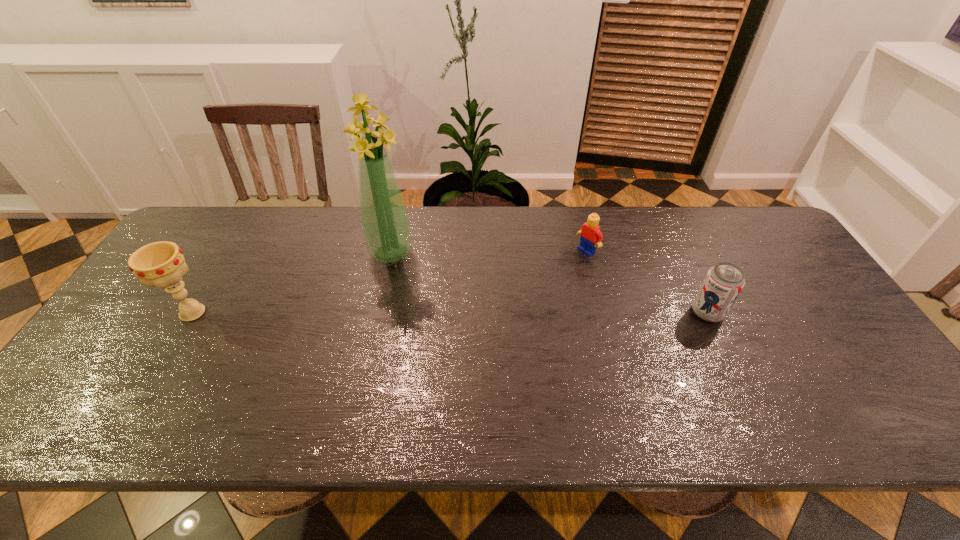
Find the location of `free space located 0.100m on the front-facing side of the bouquet`. free space located 0.100m on the front-facing side of the bouquet is located at coordinates (406, 290).

Where is `vacant area located on the face of the Lego`? The width and height of the screenshot is (960, 540). vacant area located on the face of the Lego is located at coordinates (533, 287).

At what (x,y) coordinates should I click in order to perform the action: click on free space located 0.190m on the face of the Lego. Please return your answer as a coordinate pair (x, y). This screenshot has width=960, height=540. Looking at the image, I should click on (535, 285).

Locate an element on the screen. The width and height of the screenshot is (960, 540). blank area located 0.390m on the face of the Lego is located at coordinates (481, 321).

Find the location of a particular element. bouquet at the far edge is located at coordinates (386, 227).

I want to click on Lego situated at the far edge, so click(591, 236).

Locate an element on the screen. The height and width of the screenshot is (540, 960). object that is at the left edge is located at coordinates (160, 264).

In the image, there is a desktop. Where is `vacant area at the far edge`? The height and width of the screenshot is (540, 960). vacant area at the far edge is located at coordinates (674, 212).

Find the location of a particular element. This screenshot has width=960, height=540. vacant space at the near edge of the desktop is located at coordinates (531, 368).

The image size is (960, 540). In order to click on free space at the left edge of the desktop in this screenshot , I will do `click(197, 256)`.